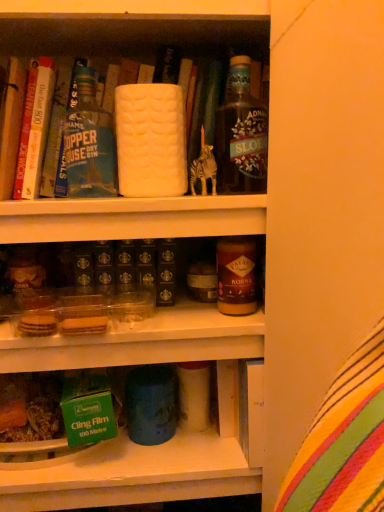
Question: Considering the relative positions of hardcover book at upper left, which ranks as the 2th book in back-to-front order, and translucent glass bottle at upper right, the 1th bottle from the right, in the image provided, is hardcover book at upper left, which ranks as the 2th book in back-to-front order, in front of translucent glass bottle at upper right, the 1th bottle from the right,?

Choices:
 (A) yes
 (B) no

Answer: (A)

Question: Is hardcover book at upper left, which ranks as the 2th book in back-to-front order, taller than translucent glass bottle at upper right, the 1th bottle from the right?

Choices:
 (A) yes
 (B) no

Answer: (A)

Question: Is hardcover book at upper left, the 1th book positioned from the front, to the right of translucent glass bottle at upper right, positioned as the 2th bottle in left-to-right order, from the viewer's perspective?

Choices:
 (A) no
 (B) yes

Answer: (A)

Question: Is translucent glass bottle at upper right, positioned as the 2th bottle in left-to-right order, completely or partially inside hardcover book at upper left, which ranks as the 2th book in back-to-front order?

Choices:
 (A) no
 (B) yes

Answer: (A)

Question: Is hardcover book at upper left, the 1th book positioned from the front, smaller than translucent glass bottle at upper right, positioned as the 2th bottle in left-to-right order?

Choices:
 (A) yes
 (B) no

Answer: (A)

Question: From the image's perspective, is green matte cling film at lower left located above or below hardcover book at upper left, which is counted as the 1th book, starting from the back?

Choices:
 (A) below
 (B) above

Answer: (A)

Question: From a real-world perspective, is green matte cling film at lower left above or below hardcover book at upper left, which is counted as the 1th book, starting from the back?

Choices:
 (A) below
 (B) above

Answer: (A)

Question: Considering the positions of green matte cling film at lower left and hardcover book at upper left, which ranks as the second book in front-to-back order, in the image, is green matte cling film at lower left wider or thinner than hardcover book at upper left, which ranks as the second book in front-to-back order,?

Choices:
 (A) wide
 (B) thin

Answer: (A)

Question: Is point (119, 437) positioned closer to the camera than point (36, 125)?

Choices:
 (A) farther
 (B) closer

Answer: (A)

Question: In terms of size, does hardcover book at upper left, which ranks as the 2th book in back-to-front order, appear bigger or smaller than hardcover book at upper left, which ranks as the second book in front-to-back order?

Choices:
 (A) big
 (B) small

Answer: (B)

Question: From a real-world perspective, is hardcover book at upper left, which ranks as the 2th book in back-to-front order, above or below hardcover book at upper left, which ranks as the second book in front-to-back order?

Choices:
 (A) above
 (B) below

Answer: (B)

Question: Considering the positions of hardcover book at upper left, the 1th book positioned from the front, and hardcover book at upper left, which ranks as the second book in front-to-back order, in the image, is hardcover book at upper left, the 1th book positioned from the front, wider or thinner than hardcover book at upper left, which ranks as the second book in front-to-back order,?

Choices:
 (A) wide
 (B) thin

Answer: (B)

Question: Considering the positions of point (18, 100) and point (39, 71), is point (18, 100) closer or farther from the camera than point (39, 71)?

Choices:
 (A) farther
 (B) closer

Answer: (B)

Question: Is translucent glass bottle at upper right, the 1th bottle from the right, inside or outside of hardcover book at upper left, which ranks as the second book in front-to-back order?

Choices:
 (A) outside
 (B) inside

Answer: (A)

Question: Is translucent glass bottle at upper right, positioned as the 2th bottle in left-to-right order, in front of or behind hardcover book at upper left, which is counted as the 1th book, starting from the back, in the image?

Choices:
 (A) behind
 (B) front

Answer: (B)